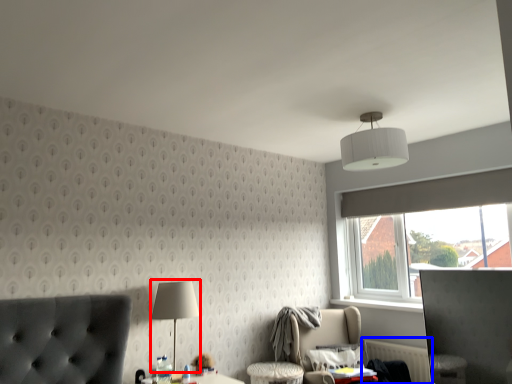
Question: Which of the following is the closest to the observer, table lamp (highlighted by a red box) or radiator (highlighted by a blue box)?

Choices:
 (A) table lamp
 (B) radiator

Answer: (A)